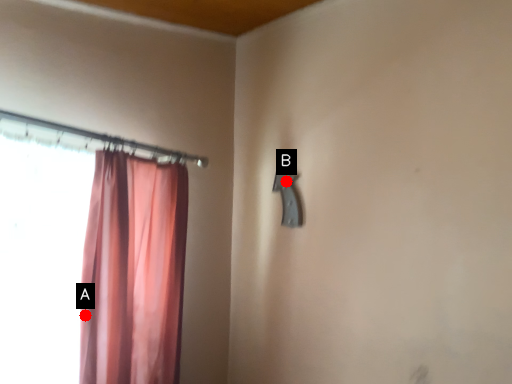
Question: Two points are circled on the image, labeled by A and B beside each circle. Which point is closer to the camera taking this photo?

Choices:
 (A) A is closer
 (B) B is closer

Answer: (A)